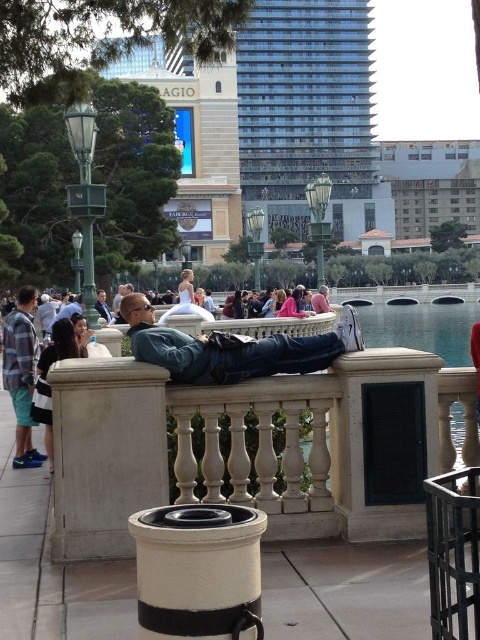
Question: Which point appears closest to the camera in this image?

Choices:
 (A) (27, 300)
 (B) (372, 410)

Answer: (B)

Question: Does white stone balustrade at center have a greater width compared to plaid flannel shirt at left?

Choices:
 (A) no
 (B) yes

Answer: (B)

Question: Which point is farther to the camera?

Choices:
 (A) (153, 355)
 (B) (101, 289)

Answer: (B)

Question: Is white stone balustrade at center positioned behind matte black jacket at center?

Choices:
 (A) yes
 (B) no

Answer: (B)

Question: Can you confirm if denim jacket at center is bigger than plaid flannel shirt at left?

Choices:
 (A) yes
 (B) no

Answer: (A)

Question: Which of the following is the farthest from the observer?

Choices:
 (A) (76, 371)
 (B) (132, 333)
 (C) (99, 304)

Answer: (C)